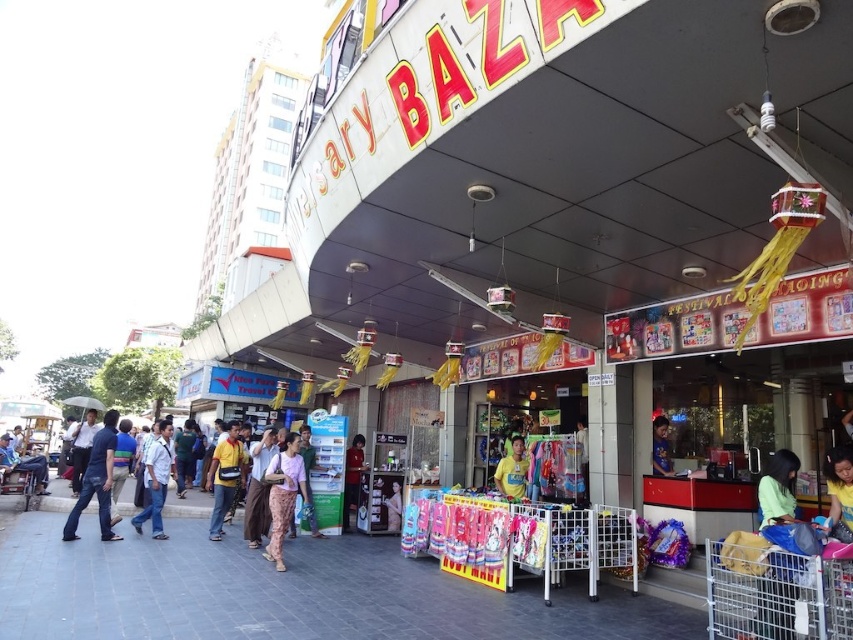
From the picture: Which is below, light purple fabric pants at center or yellow fabric bag at center?

Positioned lower is yellow fabric bag at center.

Does point (277, 515) come farther from viewer compared to point (219, 490)?

No, (277, 515) is closer to viewer.

Who is more distant from viewer, (276, 548) or (230, 426)?

The point (230, 426) is behind.

You are a GUI agent. You are given a task and a screenshot of the screen. Output one action in this format:
    pyautogui.click(x=<x>, y=<y>)
    Task: Click on the light purple fabric pants at center
    The height and width of the screenshot is (640, 853).
    Given the screenshot: What is the action you would take?
    pyautogui.click(x=283, y=493)

Is blue jeans at left to the left of light blue shirt at left from the viewer's perspective?

Incorrect, blue jeans at left is not on the left side of light blue shirt at left.

Can you confirm if blue jeans at left is shorter than light blue shirt at left?

Incorrect, blue jeans at left's height does not fall short of light blue shirt at left's.

The image size is (853, 640). In order to click on blue jeans at left in this screenshot , I will do (x=97, y=481).

Does matte red shirt at center appear on the left side of blue fabric shirt at center?

Indeed, matte red shirt at center is positioned on the left side of blue fabric shirt at center.

Between matte red shirt at center and blue fabric shirt at center, which one is positioned lower?

matte red shirt at center is below.

Does point (363, 451) lie in front of point (659, 440)?

No.

The width and height of the screenshot is (853, 640). I want to click on matte red shirt at center, so click(x=352, y=476).